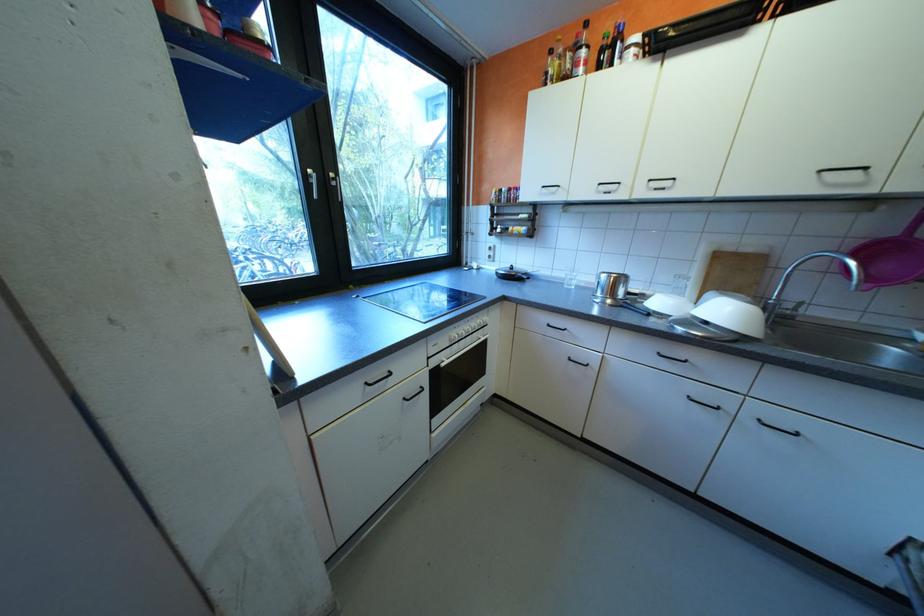
The height and width of the screenshot is (616, 924). What are the coordinates of `silver window handle` in the screenshot? It's located at (322, 183).